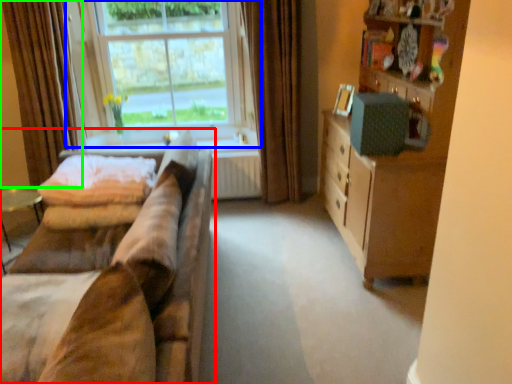
Question: Estimate the real-world distances between objects in this image. Which object is closer to studio couch (highlighted by a red box), window (highlighted by a blue box) or curtain (highlighted by a green box)?

Choices:
 (A) window
 (B) curtain

Answer: (A)